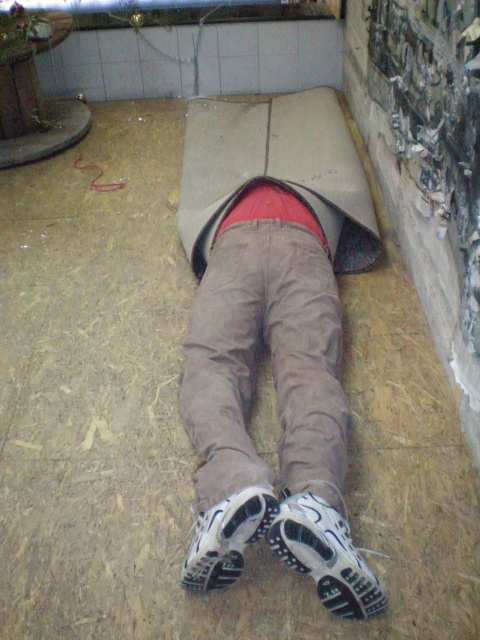
Between point (317, 500) and point (229, 550), which one is positioned in front?

Point (229, 550)

In the scene shown: Is white mesh shoe at lower center taller than white matte shoe at lower center?

Yes.

Is point (273, 532) positioned behind point (204, 566)?

No, it is not.

Locate an element on the screen. The height and width of the screenshot is (640, 480). white mesh shoe at lower center is located at coordinates (324, 554).